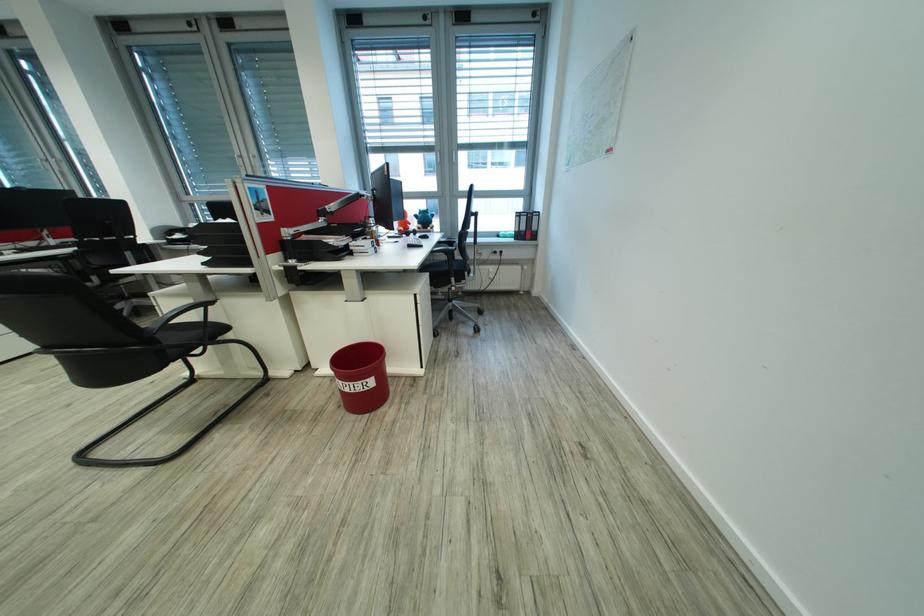
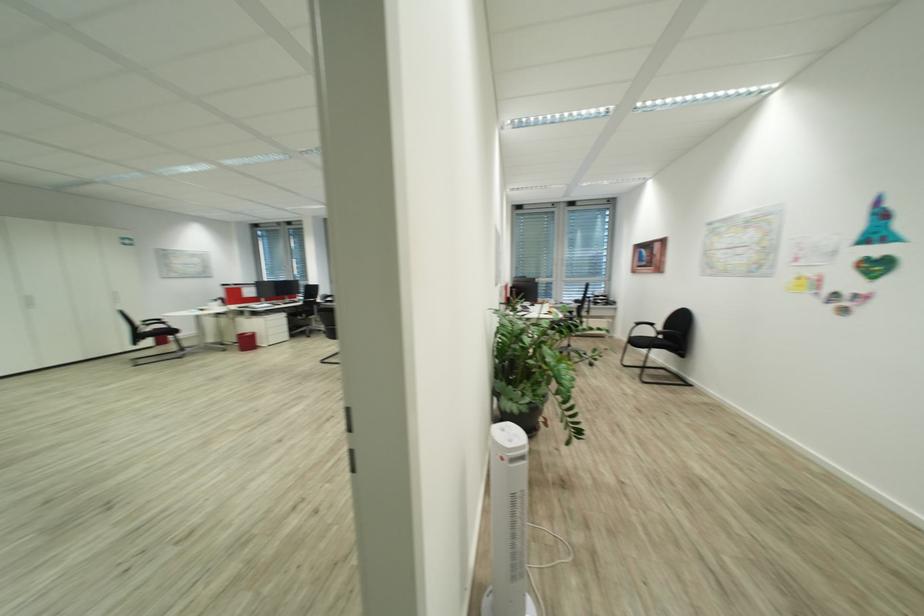
The images are taken continuously from a first-person perspective. In which direction are you moving?

The cameraman walked toward right, backward.